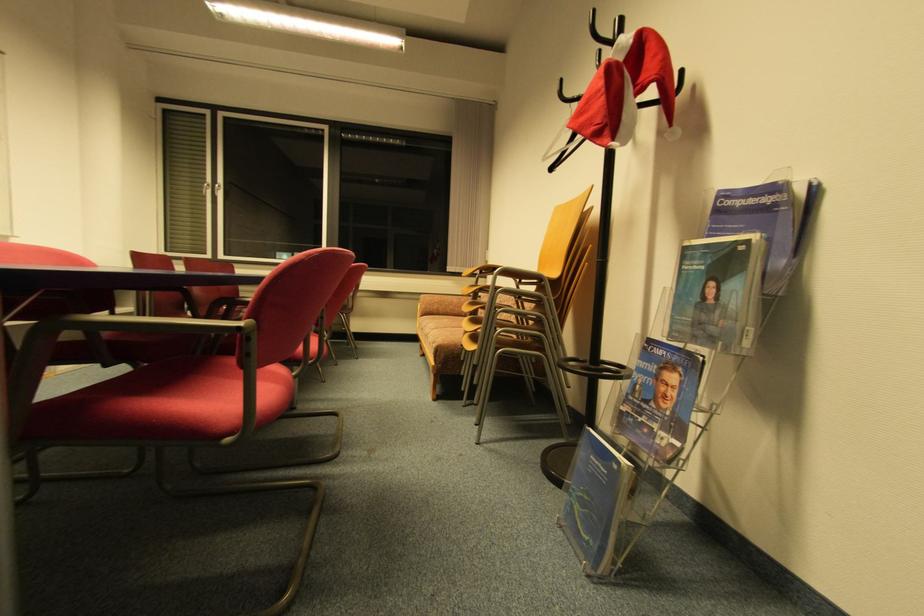
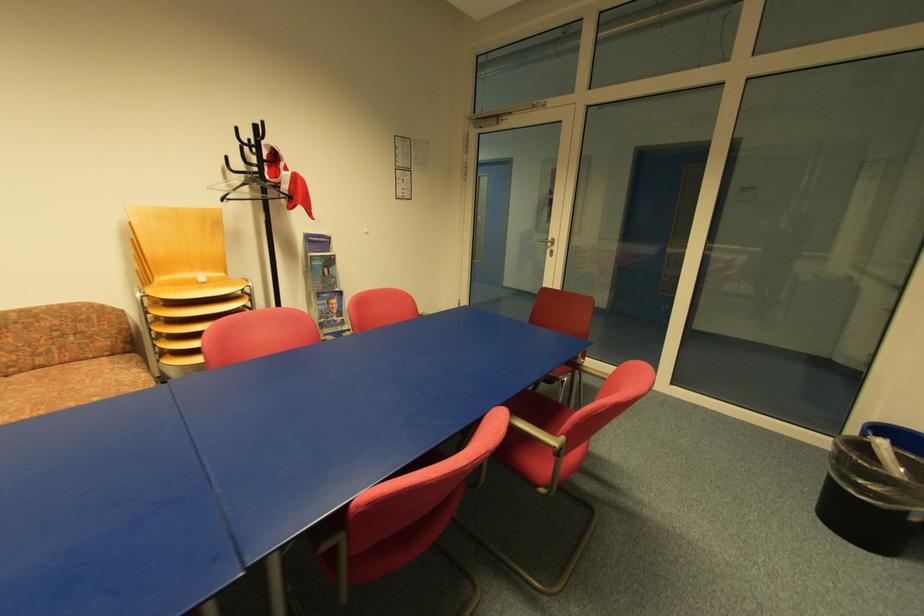
Where in the second image is the point corresponding to (715,302) from the first image?

(331, 275)